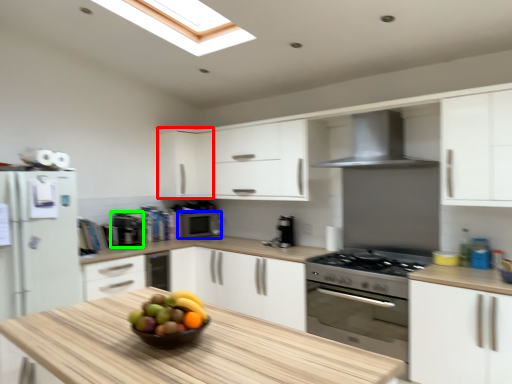
Question: Based on their relative distances, which object is nearer to cabinetry (highlighted by a red box)? Choose from appliance (highlighted by a blue box) and appliance (highlighted by a green box).

Choices:
 (A) appliance
 (B) appliance

Answer: (A)